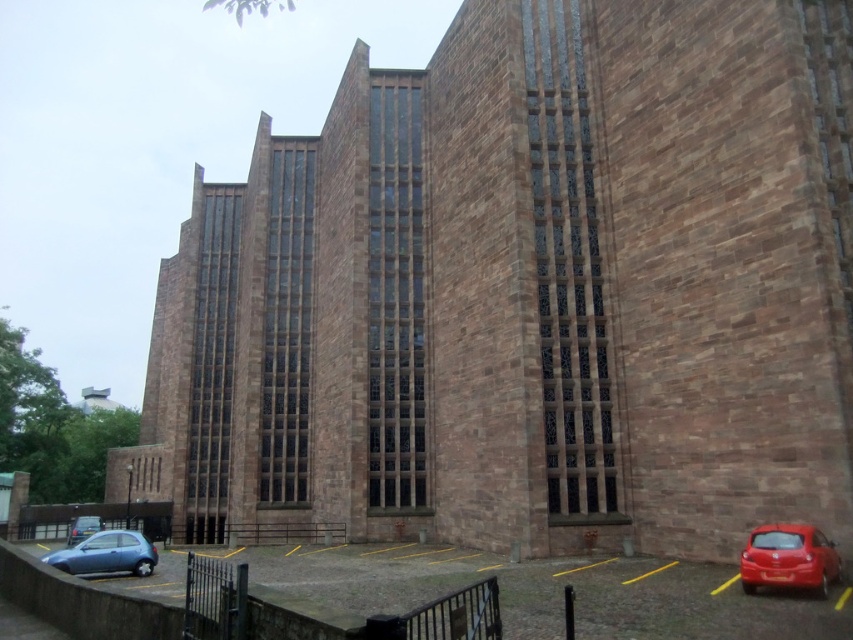
Question: Does metallic blue hatchback at lower left lie in front of metallic silver car at lower left?

Choices:
 (A) no
 (B) yes

Answer: (B)

Question: Is shiny red car at lower right below metallic silver car at lower left?

Choices:
 (A) yes
 (B) no

Answer: (B)

Question: Which object appears closest to the camera in this image?

Choices:
 (A) metallic silver car at lower left
 (B) metallic blue hatchback at lower left
 (C) shiny red car at lower right
 (D) smooth asphalt parking lot at lower center

Answer: (D)

Question: Which object is farther from the camera taking this photo?

Choices:
 (A) metallic blue hatchback at lower left
 (B) smooth asphalt parking lot at lower center
 (C) metallic silver car at lower left

Answer: (C)

Question: Which is nearer to the metallic silver car at lower left?

Choices:
 (A) shiny red car at lower right
 (B) metallic blue hatchback at lower left
 (C) smooth asphalt parking lot at lower center

Answer: (B)

Question: In this image, where is shiny red car at lower right located relative to metallic blue hatchback at lower left?

Choices:
 (A) above
 (B) below

Answer: (A)